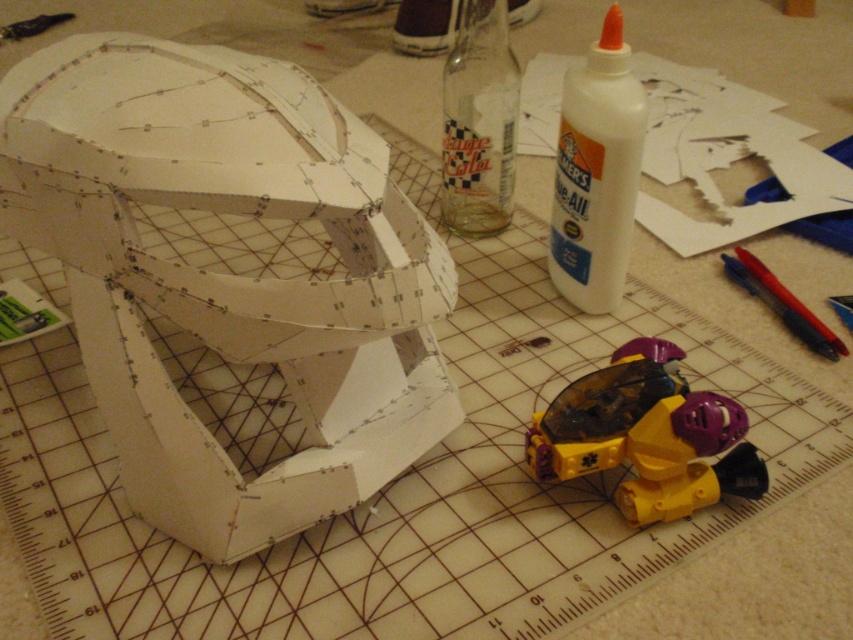
Does white paper helmet at upper left appear on the left side of yellow plastic toy at lower right?

Indeed, white paper helmet at upper left is positioned on the left side of yellow plastic toy at lower right.

Does white paper helmet at upper left come behind yellow plastic toy at lower right?

No.

Is point (294, 218) in front of point (630, 353)?

Yes, it is in front of point (630, 353).

Locate an element on the screen. The height and width of the screenshot is (640, 853). white paper helmet at upper left is located at coordinates (229, 272).